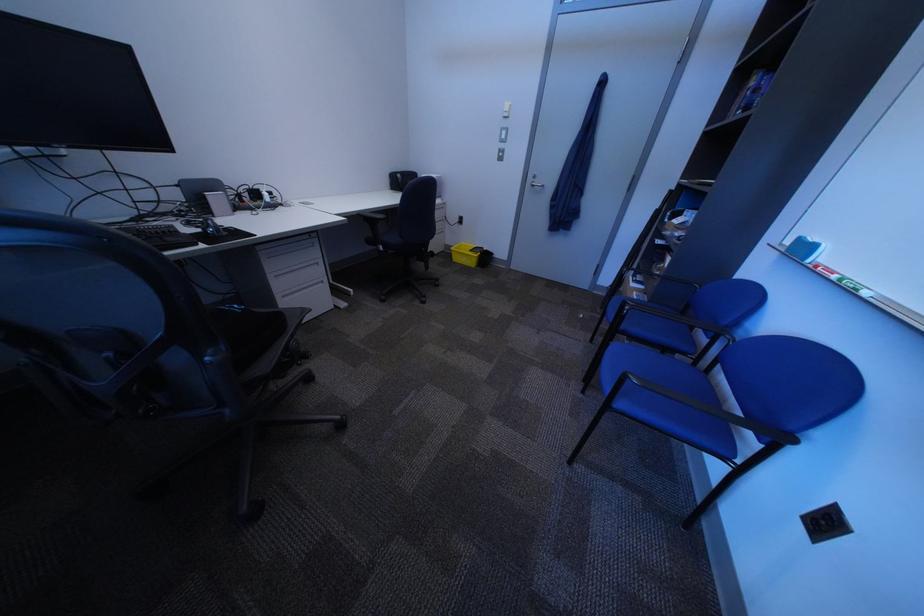
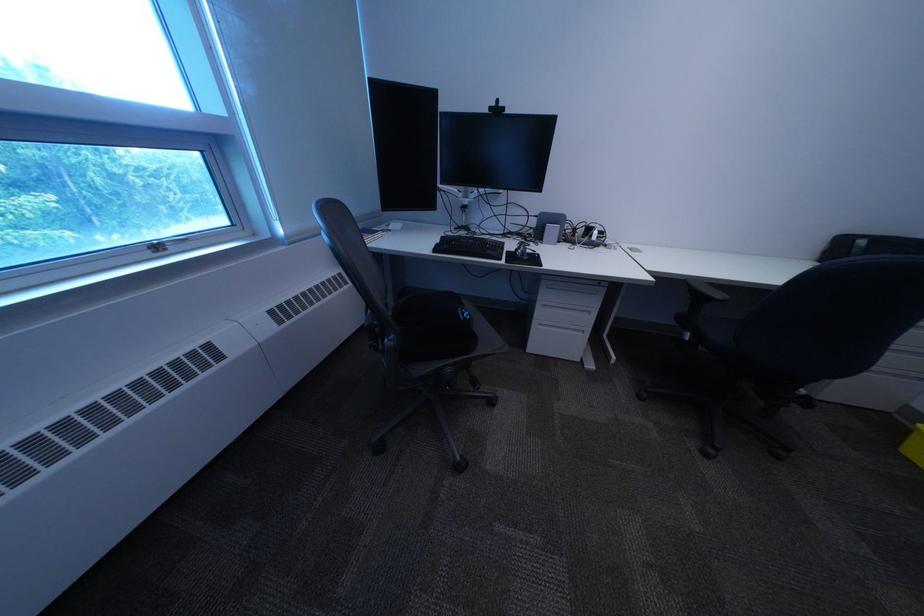
In the second image, find the point that corresponds to point (290, 278) in the first image.

(558, 307)